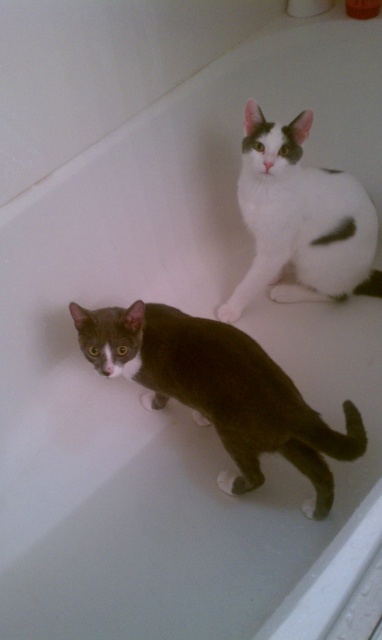
Question: Does dark gray fur cat at lower center come behind white matte fur cat at upper right?

Choices:
 (A) yes
 (B) no

Answer: (B)

Question: Does dark gray fur cat at lower center have a smaller size compared to white matte fur cat at upper right?

Choices:
 (A) yes
 (B) no

Answer: (A)

Question: Does dark gray fur cat at lower center have a greater width compared to white matte fur cat at upper right?

Choices:
 (A) yes
 (B) no

Answer: (A)